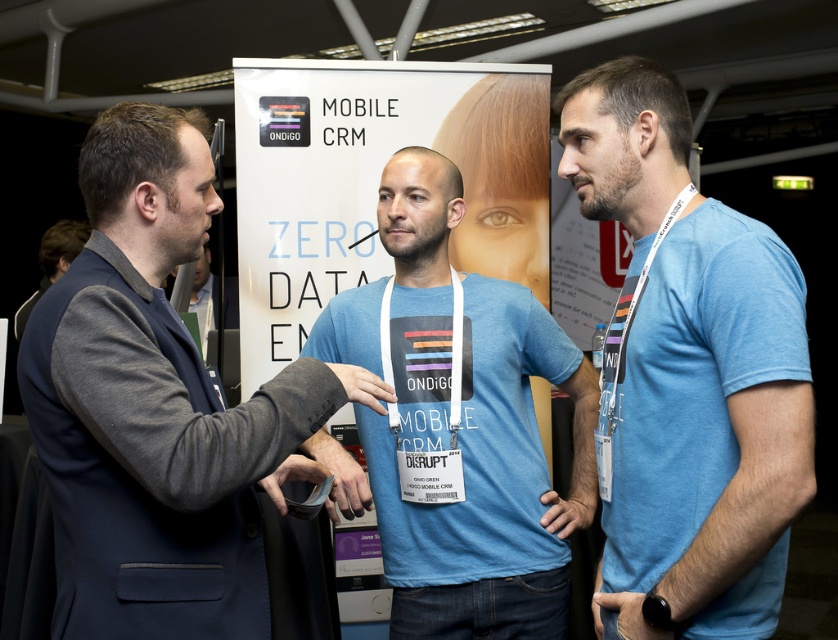
Is point (361, 493) positioned after point (24, 316)?

That is False.

Between matte black wristband at center and dark blue suit at left, which one appears on the left side from the viewer's perspective?

From the viewer's perspective, dark blue suit at left appears more on the left side.

Measure the distance between point (347, 513) and camera.

They are 6.16 feet apart.

Locate an element on the screen. This screenshot has width=838, height=640. matte black wristband at center is located at coordinates (339, 476).

Is point (366, 506) farther from camera compared to point (361, 387)?

Yes, it is behind point (361, 387).

Between matte black wristband at center and matte blue shirt at center, which one has less height?

matte blue shirt at center is shorter.

Where is `matte black wristband at center`? The image size is (838, 640). matte black wristband at center is located at coordinates (339, 476).

Is dark gray blazer at left to the left of dark blue suit at left from the viewer's perspective?

Incorrect, dark gray blazer at left is not on the left side of dark blue suit at left.

Does point (97, 428) come behind point (63, 253)?

No, (97, 428) is in front of (63, 253).

The image size is (838, 640). Find the location of `dark gray blazer at left`. dark gray blazer at left is located at coordinates (154, 406).